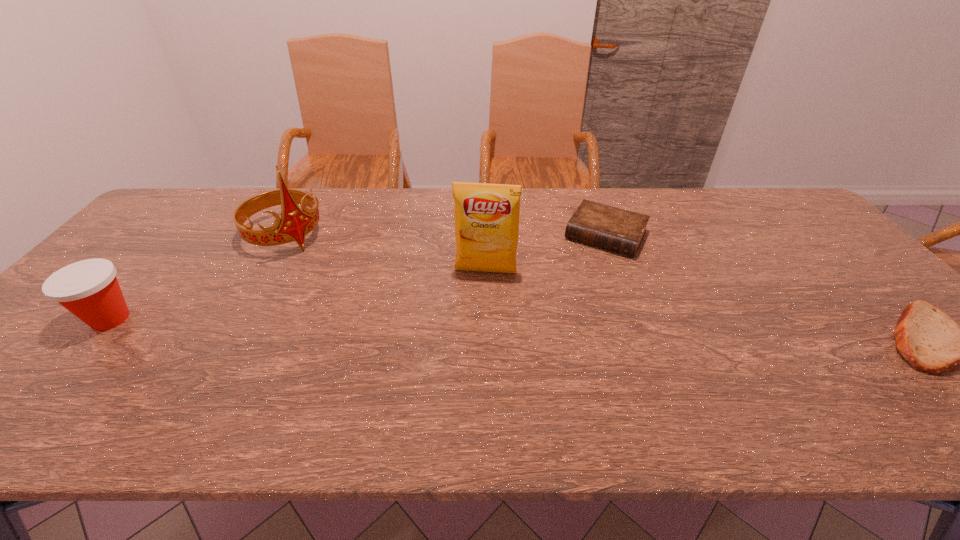
This screenshot has width=960, height=540. Find the location of `free space at the far edge`. free space at the far edge is located at coordinates (645, 203).

The height and width of the screenshot is (540, 960). Find the location of `vacant area at the near edge of the desktop`. vacant area at the near edge of the desktop is located at coordinates (470, 364).

In order to click on blank area at the left edge in this screenshot , I will do `click(71, 333)`.

In the image, there is a desktop. Find the location of `vacant space at the far right corner`. vacant space at the far right corner is located at coordinates point(804,214).

I want to click on free area in between the Dixie cup and the third farthest object, so click(x=299, y=295).

At what (x,y) coordinates should I click in order to perform the action: click on vacant space in between the Dixie cup and the crisp (potato chip). Please return your answer as a coordinate pair (x, y). The image size is (960, 540). Looking at the image, I should click on (299, 295).

You are a GUI agent. You are given a task and a screenshot of the screen. Output one action in this format:
    pyautogui.click(x=<x>, y=<y>)
    Task: Click on the free point between the third nearest object and the fourth object from right to left
    This screenshot has height=540, width=960.
    Given the screenshot: What is the action you would take?
    pyautogui.click(x=386, y=254)

Locate an element on the screen. This screenshot has width=960, height=540. free space between the third tallest object and the crisp (potato chip) is located at coordinates (299, 295).

I want to click on object that is the fourth closest one to the third nearest object, so click(x=928, y=339).

This screenshot has height=540, width=960. Identify the location of the third closest object relative to the third nearest object. (89, 289).